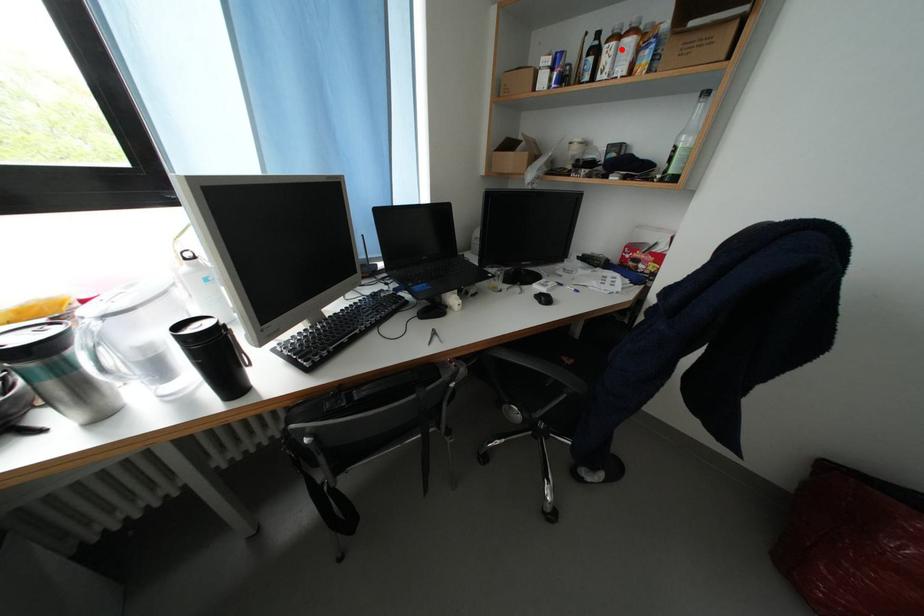
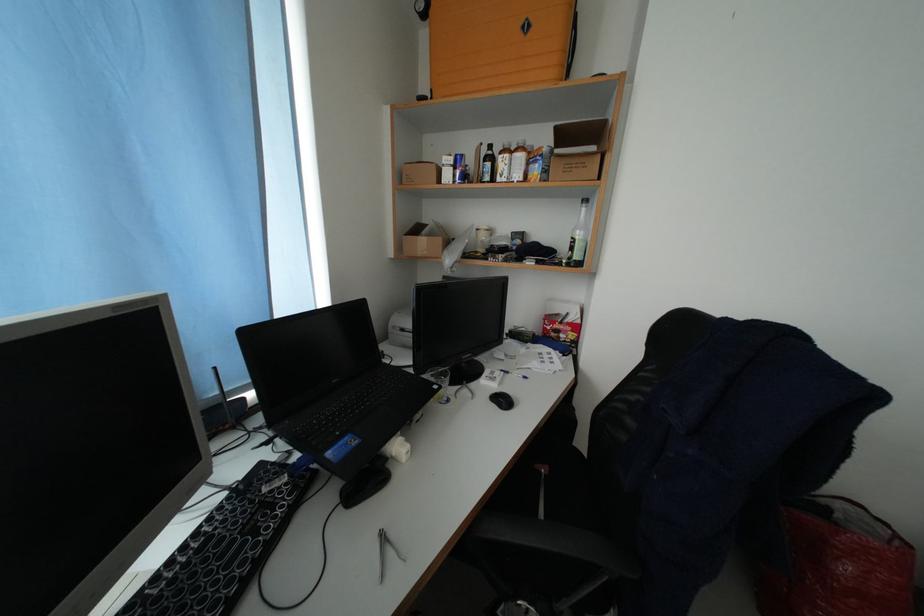
Find the pixel in the second image that matches the highlighted location in the first image.

(515, 161)